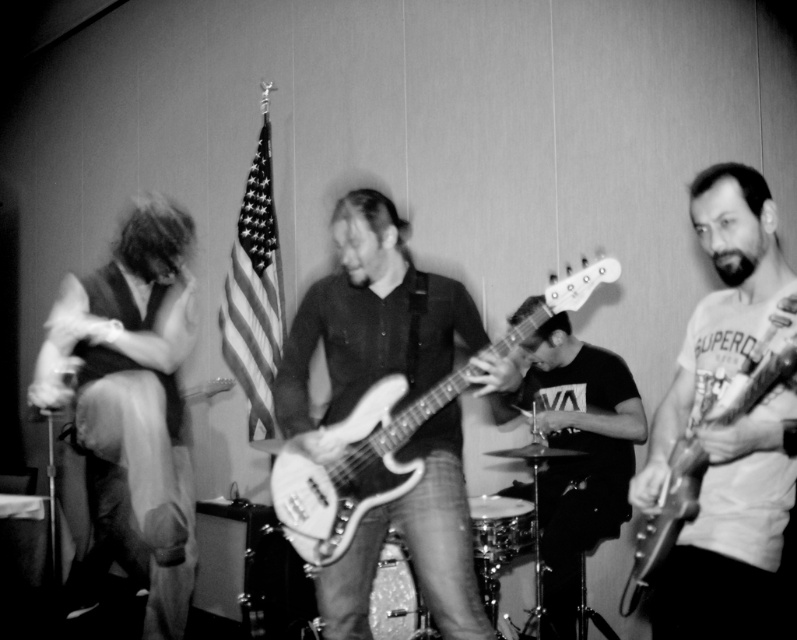
You are a photographer trying to capture a closeup of the smooth fabric shirt at left and the metallic silver guitar at right. Given their sizes, which one would require you to move closer to get a detailed shot?

The smooth fabric shirt at left is larger in size than the metallic silver guitar at right, so you would need to move closer to the metallic silver guitar at right to capture its details.

You are a photographer in the audience. You want to take a photo of the smooth fabric shirt at left and the metallic silver guitar at right. Which object is positioned lower in the frame?

The smooth fabric shirt at left is located below metallic silver guitar at right, so it is positioned lower in the frame.

You are a photographer standing at the center of the room. You want to take a photo of both the point at (84, 387) and the point at (685, 488). Which point should you focus on first to ensure both are in focus?

You should focus on the point at (685, 488) first because it is closer to you than the point at (84, 387), ensuring both will be in focus when using a shallow depth of field.